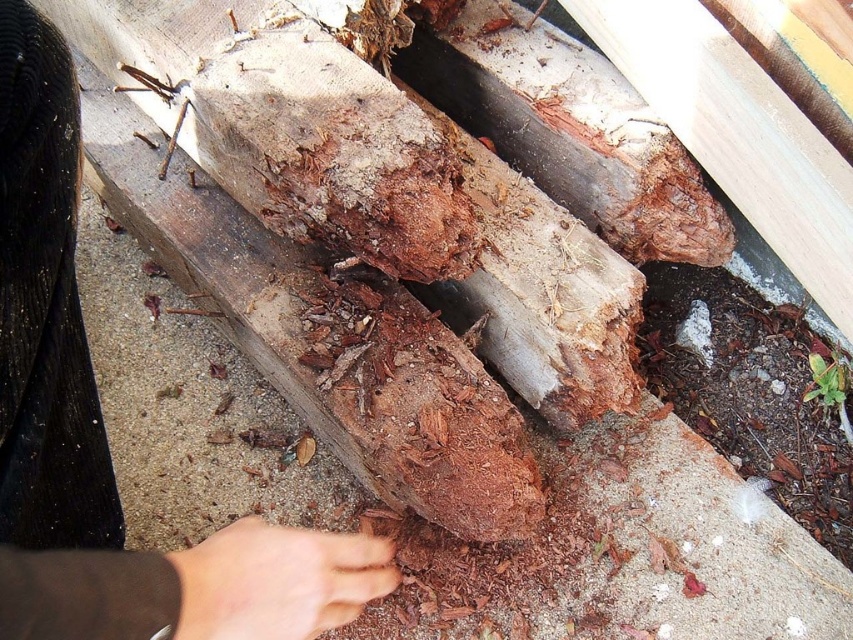
You are an inspector checking the termite damage on the wooden structure. You notice the brown leather hand at lower center and the dry skin at lower center. Which object is located to the left?

The brown leather hand at lower center is positioned on the left side of dry skin at lower center.

You are a construction inspector examining the damaged wooden structure. You notice two points marked on the image. The first point is at coordinates point (193,589) and the second point is at point (776,160). Which point is closer to your current position as you inspect the structure?

Point (193,589) is closer to your current position because it is in front of point (776,160).

You are a carpenter examining the damaged wood. You notice two points marked on the wood. Which point is closer to your face when you look at the wood? The points are labeled as point (793, 196) and point (296, 611).

Point (296, 611) is closer to your face because it is closer to the camera than point (793, 196).